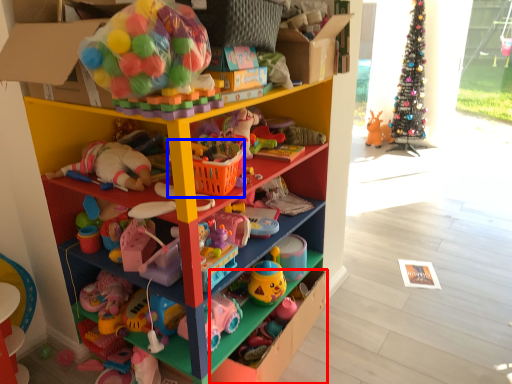
Question: Among these objects, which one is farthest to the camera, drawer (highlighted by a red box) or basket (highlighted by a blue box)?

Choices:
 (A) drawer
 (B) basket

Answer: (A)